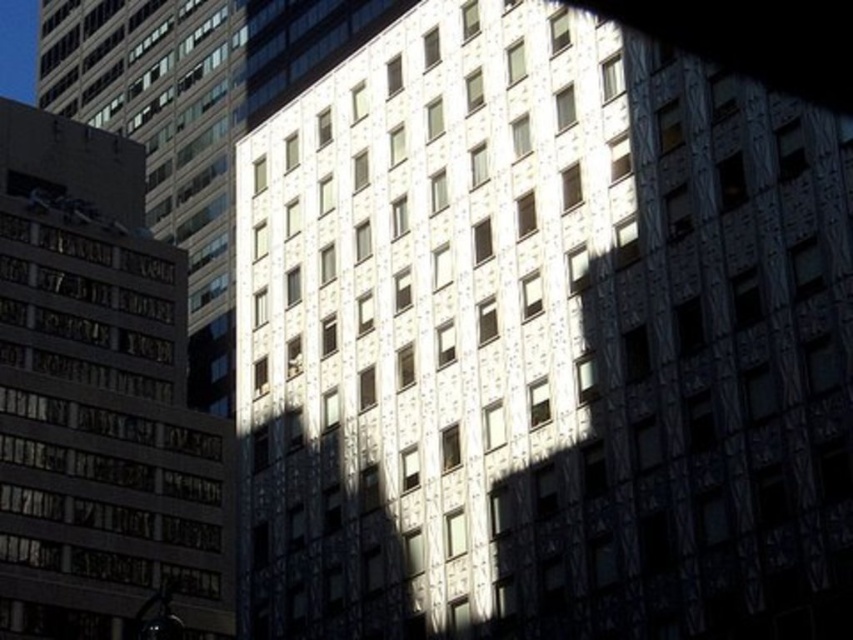
You are a drone operator trying to navigate between two points in the cityscape image. The first point is point (x=399, y=561) and the second is point (x=175, y=461). Since you want to fly as close to the buildings as possible, which point should you choose to ensure you stay closer to the structures?

Point (x=399, y=561) is closer to the camera than point (x=175, y=461). Therefore, to stay closer to the buildings, you should choose point (x=399, y=561) since it is nearer to the observer and thus closer to the structures in the scene.

You are standing on the sidewalk in front of the white textured building at center and the brick textured building at left. Which building appears taller when viewed from this perspective?

The white textured building at center appears taller than the brick textured building at left because it is positioned above it in the scene.

You are an architect planning to install a flagpole on the tallest building in the cityscape. Which building should you choose between the white textured building at center and the brick textured building at left?

The white textured building at center is taller than the brick textured building at left, so you should choose the white textured building at center to install the flagpole.